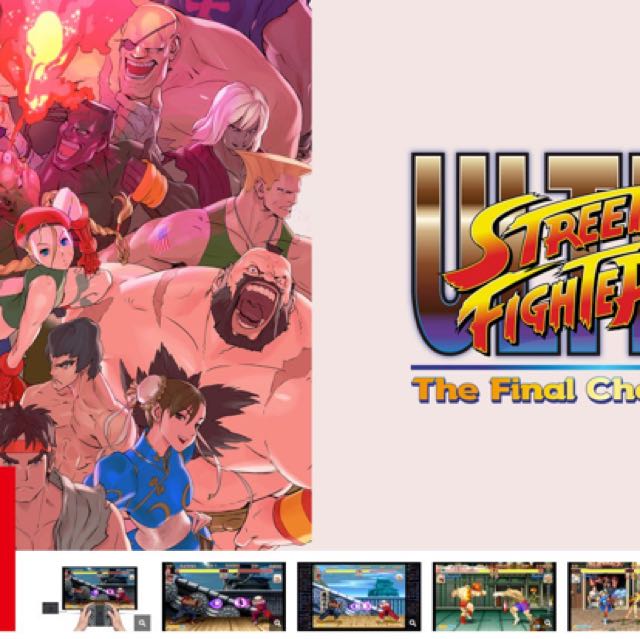
This screenshot has width=640, height=639. What are the coordinates of `green floor` in the screenshot? It's located at click(x=486, y=617).